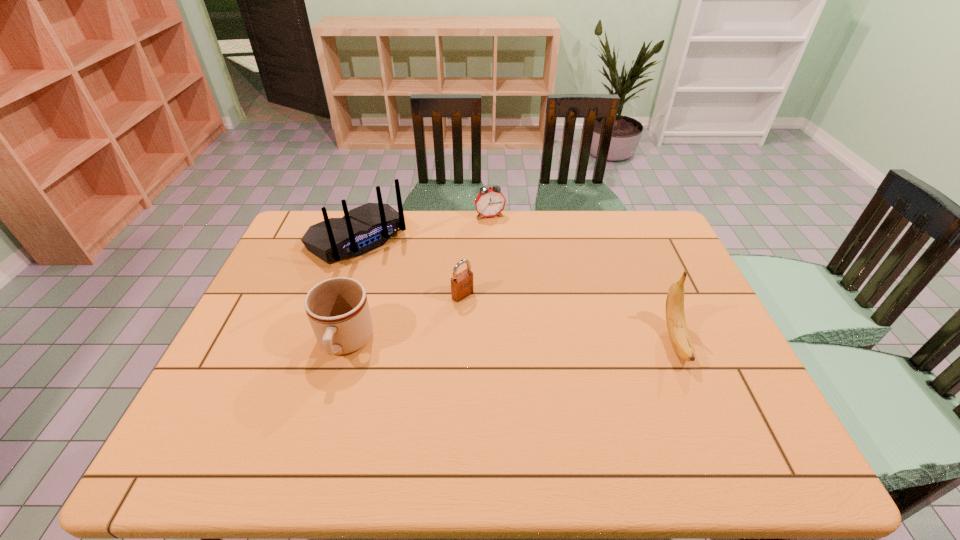
This screenshot has width=960, height=540. What are the coordinates of `vacant space located on the clock face of the alarm clock` in the screenshot? It's located at (516, 273).

The image size is (960, 540). What are the coordinates of `free space located on the clock face of the alarm clock` in the screenshot? It's located at (519, 281).

Locate an element on the screen. free region located on the clock face of the alarm clock is located at coordinates (497, 228).

This screenshot has width=960, height=540. I want to click on vacant point located on the back of the router, so click(409, 285).

The image size is (960, 540). What are the coordinates of `free point located on the back of the router` in the screenshot? It's located at (420, 295).

This screenshot has height=540, width=960. I want to click on vacant space located 0.090m on the back of the router, so click(399, 276).

Find the location of a particular element. This screenshot has height=540, width=960. alarm clock that is at the far edge is located at coordinates (490, 202).

Image resolution: width=960 pixels, height=540 pixels. Identify the location of router at the far edge. (367, 227).

Identify the location of object that is at the left edge. (367, 227).

The image size is (960, 540). Find the location of `object at the right edge`. object at the right edge is located at coordinates (675, 316).